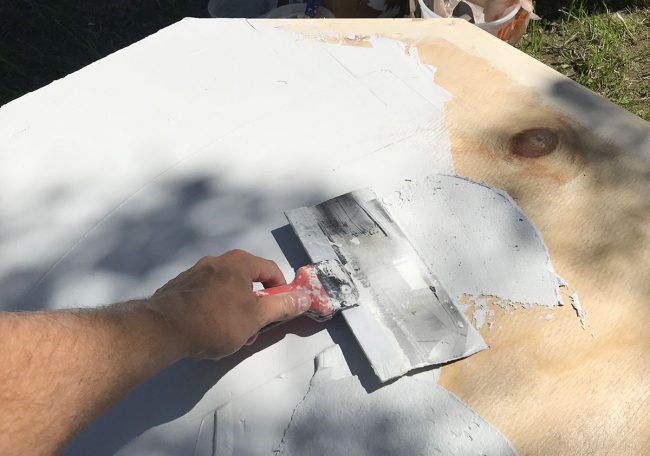
The width and height of the screenshot is (650, 456). Find the location of `board`. board is located at coordinates (500, 87).